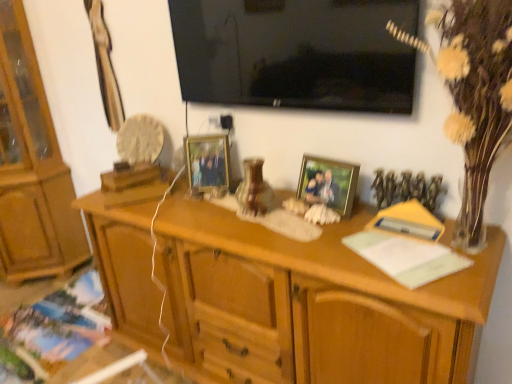
The height and width of the screenshot is (384, 512). I want to click on vacant space underneath matte paper book at lower left, acting as the third book starting from the top (from a real-world perspective), so click(x=34, y=339).